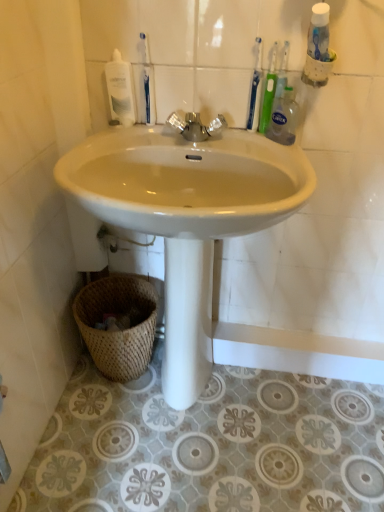
The height and width of the screenshot is (512, 384). Find the location of `free space on the front side of white glossy mouthwash at upper left`. free space on the front side of white glossy mouthwash at upper left is located at coordinates (117, 134).